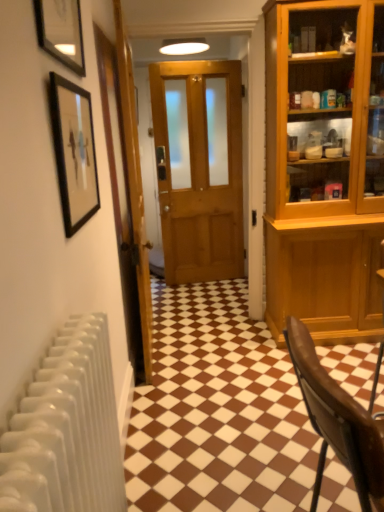
Question: Does black framed picture at upper left, positioned as the 1th picture frame in bottom-to-top order, have a lesser width compared to matte black picture frame at upper left, which is counted as the 1th picture frame, starting from the top?

Choices:
 (A) yes
 (B) no

Answer: (A)

Question: Does black framed picture at upper left, marked as the 2th picture frame in a top-to-bottom arrangement, come in front of matte black picture frame at upper left, placed as the 2th picture frame when sorted from bottom to top?

Choices:
 (A) yes
 (B) no

Answer: (B)

Question: Does black framed picture at upper left, positioned as the 1th picture frame in bottom-to-top order, touch matte black picture frame at upper left, which is counted as the 1th picture frame, starting from the top?

Choices:
 (A) yes
 (B) no

Answer: (B)

Question: Is matte black picture frame at upper left, which is counted as the 1th picture frame, starting from the top, surrounded by black framed picture at upper left, marked as the 2th picture frame in a top-to-bottom arrangement?

Choices:
 (A) no
 (B) yes

Answer: (A)

Question: Considering the relative sizes of black framed picture at upper left, positioned as the 1th picture frame in bottom-to-top order, and matte black picture frame at upper left, which is counted as the 1th picture frame, starting from the top, in the image provided, is black framed picture at upper left, positioned as the 1th picture frame in bottom-to-top order, smaller than matte black picture frame at upper left, which is counted as the 1th picture frame, starting from the top,?

Choices:
 (A) no
 (B) yes

Answer: (A)

Question: Considering their positions, is black framed picture at upper left, positioned as the 1th picture frame in bottom-to-top order, located in front of or behind brown glossy tile at center?

Choices:
 (A) behind
 (B) front

Answer: (B)

Question: Would you say black framed picture at upper left, marked as the 2th picture frame in a top-to-bottom arrangement, is inside or outside brown glossy tile at center?

Choices:
 (A) outside
 (B) inside

Answer: (A)

Question: Considering the positions of black framed picture at upper left, positioned as the 1th picture frame in bottom-to-top order, and brown glossy tile at center in the image, is black framed picture at upper left, positioned as the 1th picture frame in bottom-to-top order, bigger or smaller than brown glossy tile at center?

Choices:
 (A) small
 (B) big

Answer: (A)

Question: Is point (62, 95) positioned closer to the camera than point (200, 407)?

Choices:
 (A) closer
 (B) farther

Answer: (A)

Question: Considering the positions of brown leather chair at lower right and wooden door at center, the second door positioned from the left, in the image, is brown leather chair at lower right taller or shorter than wooden door at center, the second door positioned from the left,?

Choices:
 (A) tall
 (B) short

Answer: (B)

Question: Considering the positions of point (357, 420) and point (162, 222), is point (357, 420) closer or farther from the camera than point (162, 222)?

Choices:
 (A) farther
 (B) closer

Answer: (B)

Question: From the image's perspective, is brown leather chair at lower right positioned above or below wooden door at center, the second door positioned from the left?

Choices:
 (A) above
 (B) below

Answer: (B)

Question: Looking at their shapes, would you say brown leather chair at lower right is wider or thinner than wooden door at center, the second door positioned from the left?

Choices:
 (A) thin
 (B) wide

Answer: (B)

Question: From a real-world perspective, relative to matte black picture frame at upper left, placed as the 2th picture frame when sorted from bottom to top, is brown glossy tile at center vertically above or below?

Choices:
 (A) above
 (B) below

Answer: (B)

Question: Is point (167, 357) positioned closer to the camera than point (49, 22)?

Choices:
 (A) farther
 (B) closer

Answer: (A)